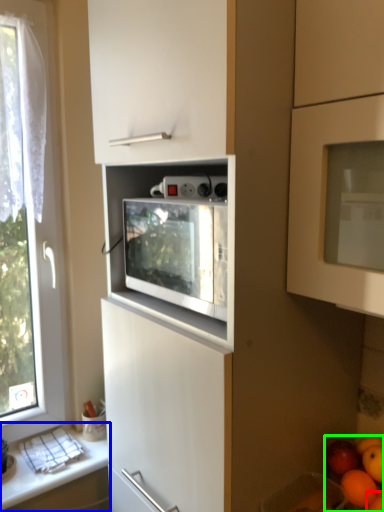
Question: Estimate the real-world distances between objects in this image. Which object is farther from orange (highlighted by a red box), countertop (highlighted by a blue box) or fruit (highlighted by a green box)?

Choices:
 (A) countertop
 (B) fruit

Answer: (A)